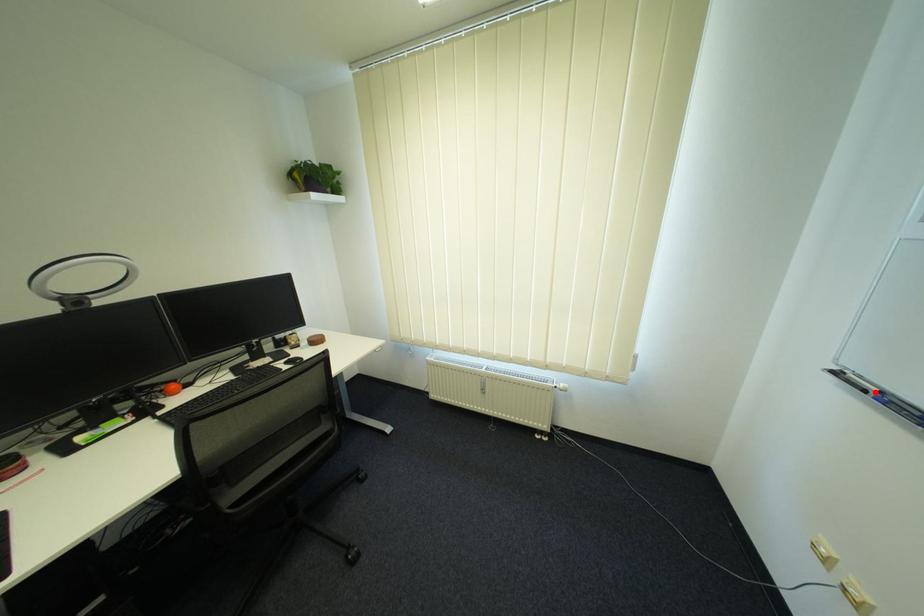
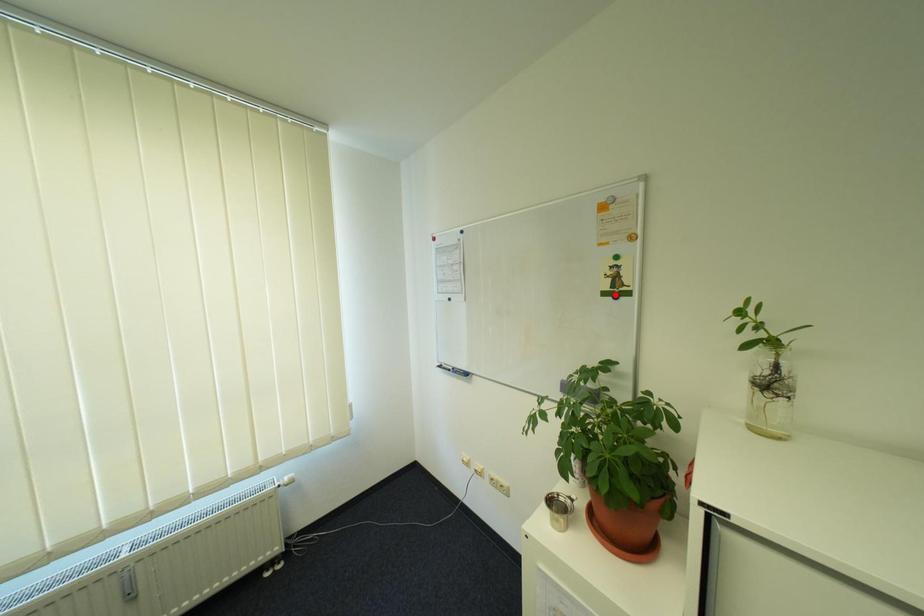
I am providing you with two images of the same scene from different viewpoints. A red point is marked on the first image and another point is marked on the second image. Are the points marked in image1 and image2 representing the same 3D position?

No